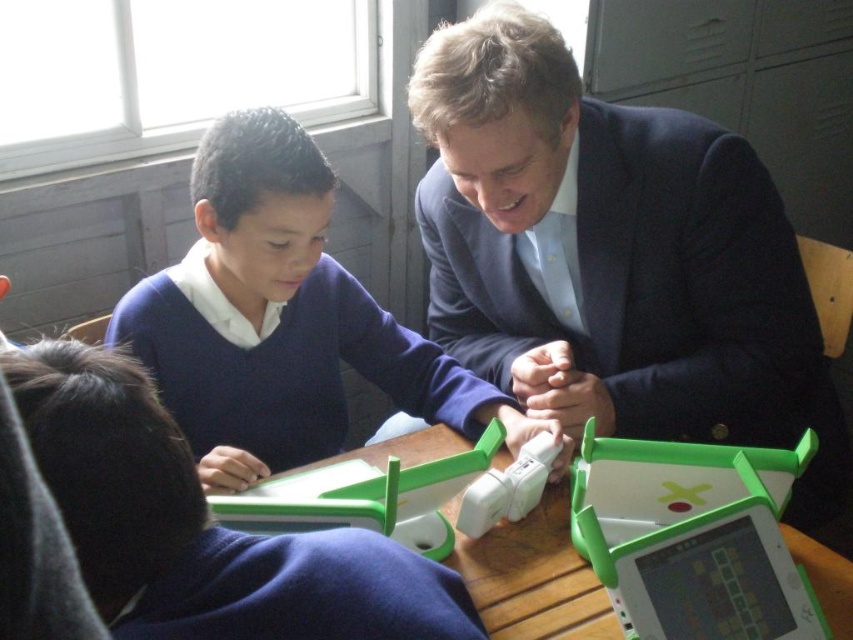
Question: Which object is farther from the camera taking this photo?

Choices:
 (A) dark blue sweater at upper center
 (B) wooden table at center
 (C) dark blue suit at center

Answer: (A)

Question: Does dark blue suit at center appear on the right side of wooden table at center?

Choices:
 (A) yes
 (B) no

Answer: (A)

Question: Which point is farther to the camera?

Choices:
 (A) (494, 538)
 (B) (798, 500)
 (C) (258, 314)
 (D) (392, 580)

Answer: (C)

Question: Which point appears closest to the camera in this image?

Choices:
 (A) (842, 568)
 (B) (264, 280)
 (C) (752, 246)

Answer: (A)

Question: Is matte green plastic tablet at lower left positioned in front of wooden table at center?

Choices:
 (A) no
 (B) yes

Answer: (B)

Question: Does dark blue suit at center have a larger size compared to wooden table at center?

Choices:
 (A) yes
 (B) no

Answer: (A)